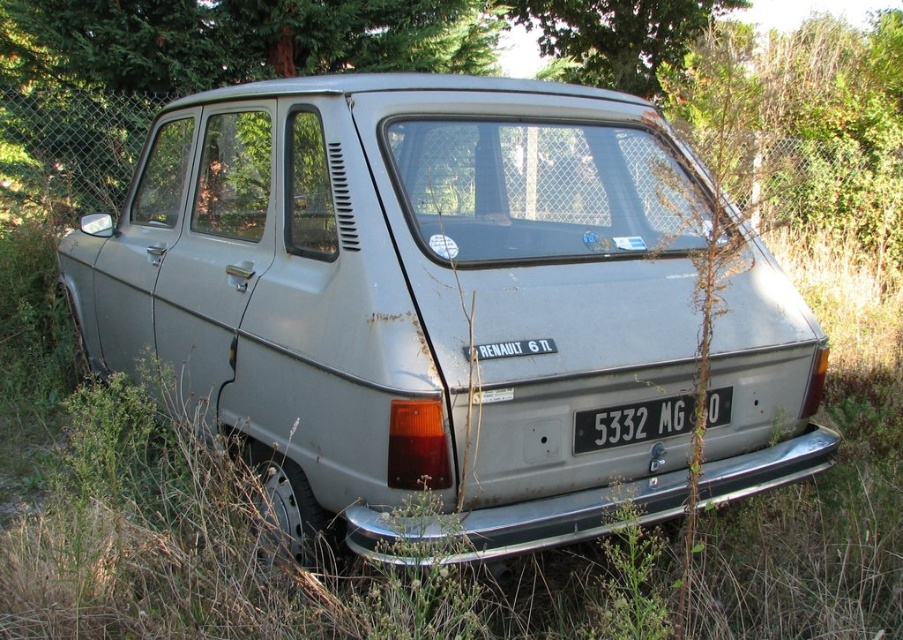
You are a photographer trying to capture the entire matte silver car at center and the white plastic license plate at center in one frame. Given their sizes, which object will occupy more space in the photo?

The matte silver car at center is larger in size than the white plastic license plate at center, so it will occupy more space in the photo.

From the picture: You are a mechanic inspecting a vintage Renault 6 TL. You need to access the license plate to check its registration details. Given the distance between the matte silver car at center and the white plastic license plate at center, can you reach the license plate without moving the car?

The matte silver car at center and white plastic license plate at center are 36.23 inches apart from each other. Since the license plate is attached to the car, the distance mentioned refers to their positions on the car. As a mechanic, you can reach the white plastic license plate at center without moving the car because it is part of the car itself.